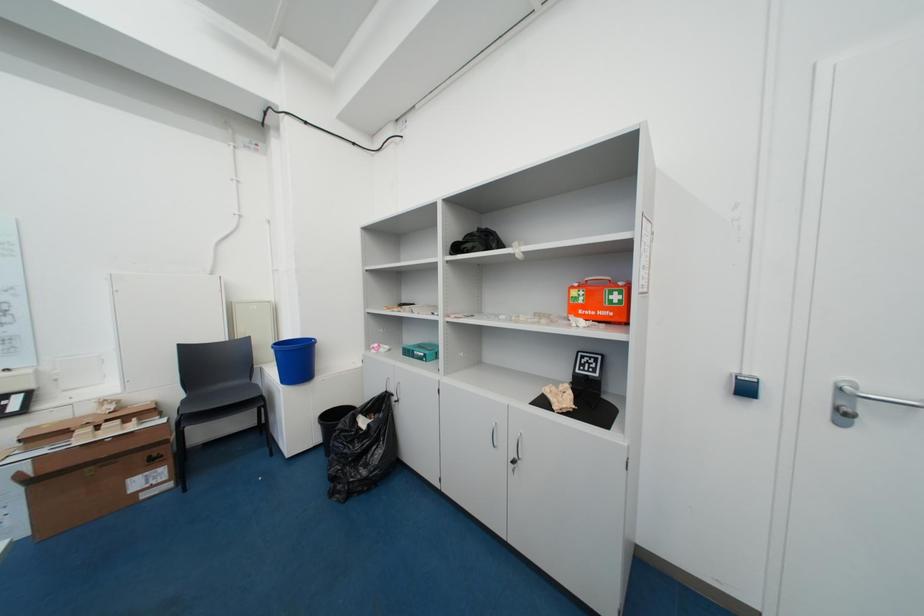
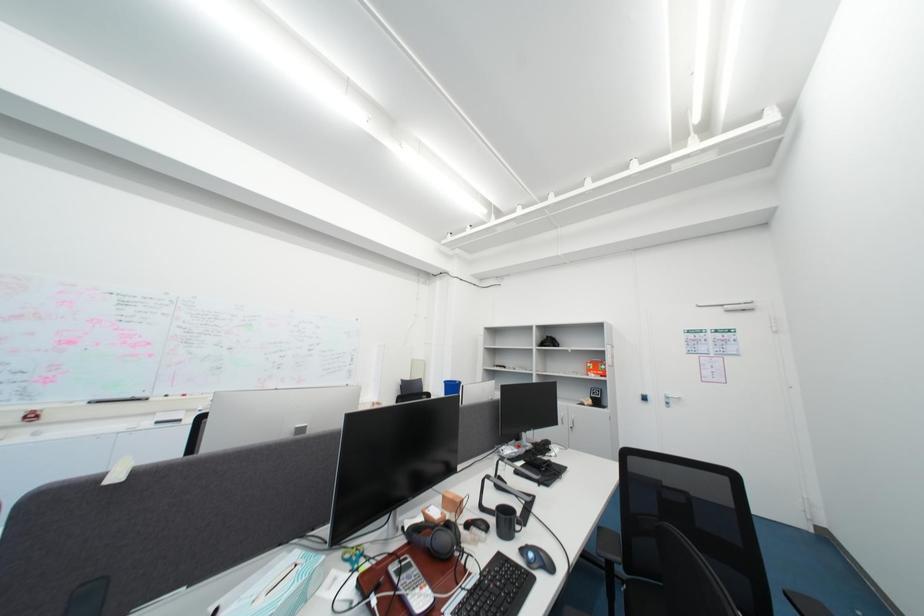
Which direction would the cameraman need to move to produce the second image?

The movement direction of the cameraman is left, backward.